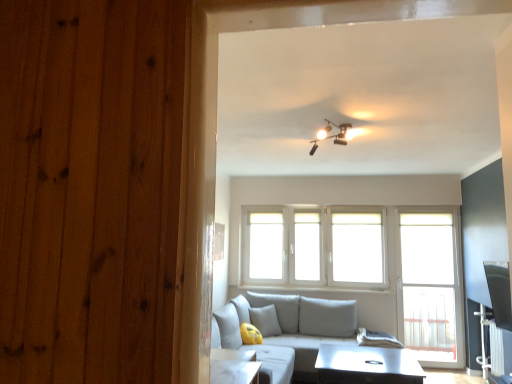
Question: Is light gray fabric couch at center at the right side of white fabric curtain at lower right?

Choices:
 (A) yes
 (B) no

Answer: (B)

Question: Considering the relative sizes of light gray fabric couch at center and white fabric curtain at lower right in the image provided, is light gray fabric couch at center thinner than white fabric curtain at lower right?

Choices:
 (A) no
 (B) yes

Answer: (A)

Question: Does light gray fabric couch at center lie in front of white fabric curtain at lower right?

Choices:
 (A) yes
 (B) no

Answer: (B)

Question: From the image's perspective, does light gray fabric couch at center appear higher than white fabric curtain at lower right?

Choices:
 (A) yes
 (B) no

Answer: (B)

Question: Is light gray fabric couch at center not near white fabric curtain at lower right?

Choices:
 (A) yes
 (B) no

Answer: (A)

Question: In terms of width, does clear plastic screen door at right look wider or thinner when compared to light gray fabric couch at center?

Choices:
 (A) wide
 (B) thin

Answer: (B)

Question: Is clear plastic screen door at right in front of or behind light gray fabric couch at center in the image?

Choices:
 (A) behind
 (B) front

Answer: (A)

Question: Is point (406, 264) positioned closer to the camera than point (293, 375)?

Choices:
 (A) closer
 (B) farther

Answer: (B)

Question: Based on their positions, is clear plastic screen door at right located to the left or right of light gray fabric couch at center?

Choices:
 (A) left
 (B) right

Answer: (B)

Question: Considering the relative positions of matte black track lights at upper center and yellow fabric pillow at lower center in the image provided, is matte black track lights at upper center to the left or to the right of yellow fabric pillow at lower center?

Choices:
 (A) right
 (B) left

Answer: (A)

Question: From their relative heights in the image, would you say matte black track lights at upper center is taller or shorter than yellow fabric pillow at lower center?

Choices:
 (A) tall
 (B) short

Answer: (B)

Question: Does point (334, 140) appear closer or farther from the camera than point (270, 309)?

Choices:
 (A) farther
 (B) closer

Answer: (B)

Question: Do you think matte black track lights at upper center is within yellow fabric pillow at lower center, or outside of it?

Choices:
 (A) inside
 (B) outside

Answer: (B)

Question: From a real-world perspective, relative to matte black track lights at upper center, is light gray fabric couch at center vertically above or below?

Choices:
 (A) below
 (B) above

Answer: (A)

Question: In terms of width, does light gray fabric couch at center look wider or thinner when compared to matte black track lights at upper center?

Choices:
 (A) thin
 (B) wide

Answer: (B)